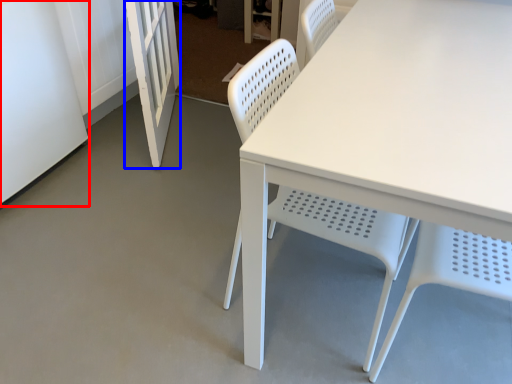
Question: Which point is further to the camera, screen door (highlighted by a red box) or screen door (highlighted by a blue box)?

Choices:
 (A) screen door
 (B) screen door

Answer: (B)